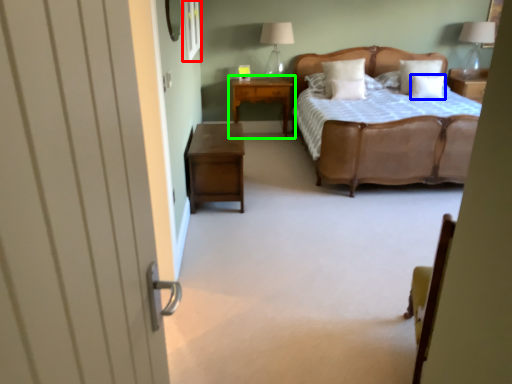
Question: Which is farther away from window (highlighted by a red box)? pillow (highlighted by a blue box) or nightstand (highlighted by a green box)?

Choices:
 (A) pillow
 (B) nightstand

Answer: (A)